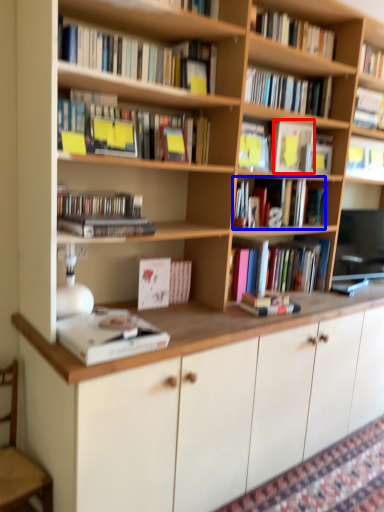
Question: Which object appears farthest to the camera in this image, paperback book (highlighted by a red box) or book (highlighted by a blue box)?

Choices:
 (A) paperback book
 (B) book

Answer: (B)